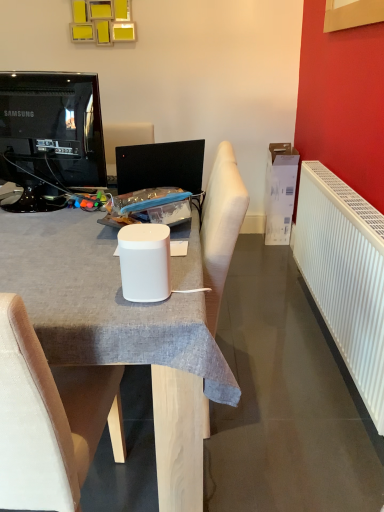
Question: Does white matte speaker at center turn towards white plastic radiator at right?

Choices:
 (A) yes
 (B) no

Answer: (B)

Question: Is white matte speaker at center facing away from white plastic radiator at right?

Choices:
 (A) no
 (B) yes

Answer: (A)

Question: Is white matte speaker at center at the left side of white plastic radiator at right?

Choices:
 (A) no
 (B) yes

Answer: (B)

Question: From a real-world perspective, is white matte speaker at center on top of white plastic radiator at right?

Choices:
 (A) yes
 (B) no

Answer: (A)

Question: Is white plastic radiator at right inside white matte speaker at center?

Choices:
 (A) no
 (B) yes

Answer: (A)

Question: In terms of height, does white matte speaker at center look taller or shorter compared to white fabric chair at center?

Choices:
 (A) short
 (B) tall

Answer: (A)

Question: Looking at their shapes, would you say white matte speaker at center is wider or thinner than white fabric chair at center?

Choices:
 (A) wide
 (B) thin

Answer: (B)

Question: From a real-world perspective, is white matte speaker at center positioned above or below white fabric chair at center?

Choices:
 (A) above
 (B) below

Answer: (A)

Question: Is white matte speaker at center spatially inside white fabric chair at center, or outside of it?

Choices:
 (A) inside
 (B) outside

Answer: (B)

Question: From a real-world perspective, is white matte speaker at center physically located above or below white plastic radiator at right?

Choices:
 (A) below
 (B) above

Answer: (A)

Question: Based on their positions, is white matte speaker at center located to the left or right of white plastic radiator at right?

Choices:
 (A) right
 (B) left

Answer: (B)

Question: Relative to white plastic radiator at right, is white matte speaker at center in front or behind?

Choices:
 (A) behind
 (B) front

Answer: (B)

Question: Considering the positions of white matte speaker at center and white plastic radiator at right in the image, is white matte speaker at center wider or thinner than white plastic radiator at right?

Choices:
 (A) wide
 (B) thin

Answer: (A)

Question: Considering their positions, is white fabric chair at center located in front of or behind white matte speaker at center?

Choices:
 (A) behind
 (B) front

Answer: (B)

Question: From a real-world perspective, relative to white matte speaker at center, is white fabric chair at center vertically above or below?

Choices:
 (A) above
 (B) below

Answer: (B)